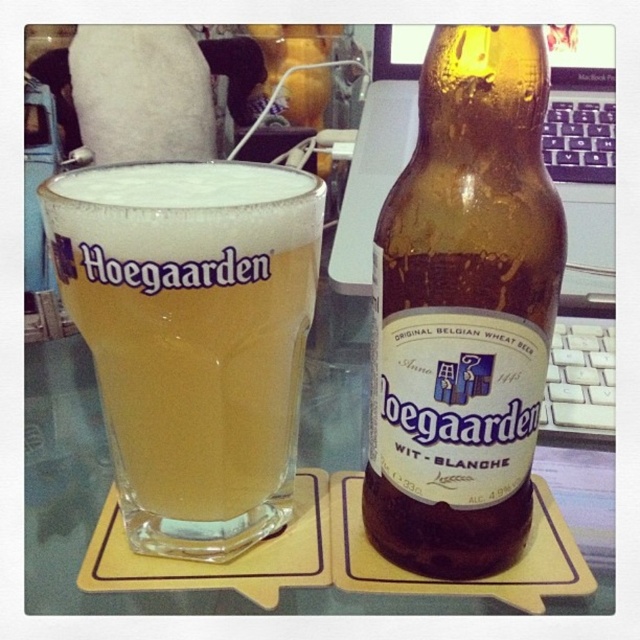
Question: Which of the following is the closest to the observer?

Choices:
 (A) (284, 256)
 (B) (532, 321)

Answer: (A)

Question: Is brown glass bottle at center positioned in front of golden glass at center?

Choices:
 (A) no
 (B) yes

Answer: (A)

Question: Does brown glass bottle at center appear on the left side of golden glass at center?

Choices:
 (A) yes
 (B) no

Answer: (B)

Question: Is brown glass bottle at center smaller than golden glass at center?

Choices:
 (A) yes
 (B) no

Answer: (A)

Question: Among these objects, which one is nearest to the camera?

Choices:
 (A) brown glass bottle at center
 (B) golden glass at center

Answer: (B)